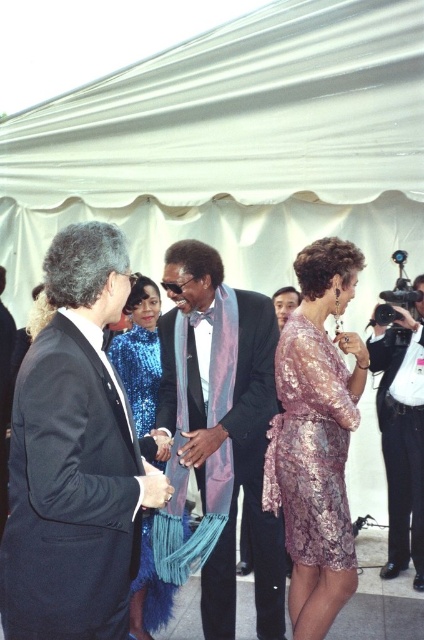
You are a photographer at the event and need to position a camera on a tripod to capture both the white fabric canopy at upper center and the lavender sequined dress at center. The tripod has a maximum height adjustment of 2 meters. Can the camera be positioned to include both objects in the frame without moving the tripod?

The white fabric canopy at upper center is taller than the lavender sequined dress at center. Since the tripod can reach up to 2 meters, it depends on the actual heights of the objects. However, the description only states their relative height, not absolute measurements. Without specific heights, it is impossible to determine if the tripod can accommodate both.

You are standing at the entrance of the tent and want to take a photo of the point at coordinates point (250, 228). If your camera has a maximum focus range of 15 feet, will you be able to focus on that point?

The distance of point (250, 228) from the viewer is 16.91 feet, which exceeds the camera maximum focus range of 15 feet. Therefore, the camera will not be able to focus on that point.

You are a photographer at the event and need to position a spotlight on the lavender sequined dress at center and the blue sequined dress at center. Since the spotlight can only illuminate one dress at a time, which dress should you aim the spotlight at first to ensure it reaches the taller one?

The lavender sequined dress at center is much taller than the blue sequined dress at center, so you should aim the spotlight at the lavender sequined dress at center first to ensure it reaches the taller one.